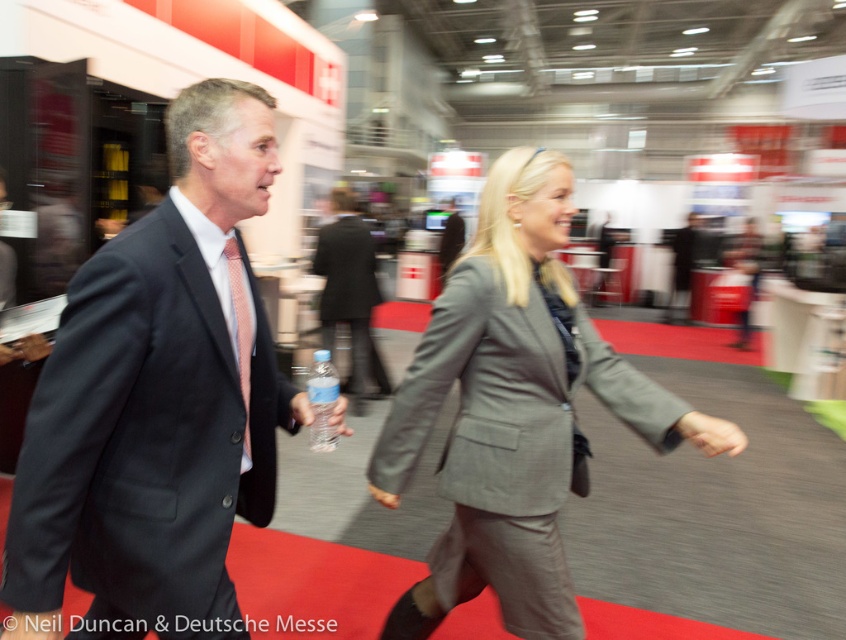
Question: Which object is the farthest from the dark gray suit at center?

Choices:
 (A) gray fabric suit at center
 (B) clear plastic bottle at center

Answer: (B)

Question: Estimate the real-world distances between objects in this image. Which object is closer to the dark gray suit at center?

Choices:
 (A) clear plastic bottle at center
 (B) gray fabric suit at center

Answer: (B)

Question: Which point appears farthest from the camera in this image?

Choices:
 (A) (361, 369)
 (B) (476, 531)
 (C) (140, 445)

Answer: (A)

Question: Observing the image, what is the correct spatial positioning of dark gray suit at center in reference to clear plastic bottle at center?

Choices:
 (A) right
 (B) left

Answer: (A)

Question: Does gray fabric suit at center have a larger size compared to clear plastic bottle at center?

Choices:
 (A) yes
 (B) no

Answer: (A)

Question: Observing the image, what is the correct spatial positioning of gray fabric suit at center in reference to clear plastic bottle at center?

Choices:
 (A) above
 (B) below

Answer: (B)